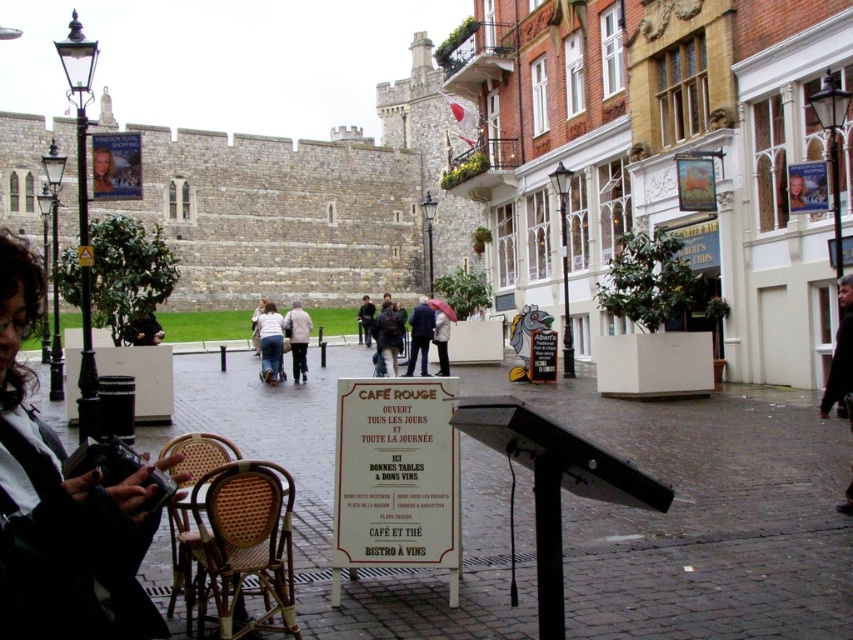
Is woven wicker chair at lower left above dark brown leather jacket at lower left?

Actually, woven wicker chair at lower left is below dark brown leather jacket at lower left.

Based on the photo, can you confirm if woven wicker chair at lower left is positioned to the left of dark brown leather jacket at lower left?

In fact, woven wicker chair at lower left is to the right of dark brown leather jacket at lower left.

Is point (183, 532) farther from viewer compared to point (131, 340)?

No, (183, 532) is in front of (131, 340).

Find the location of a particular element. woven wicker chair at lower left is located at coordinates (187, 566).

How far apart are dark gray jacket at lower left and dark blue jacket at center?

47.26 meters

Does dark gray jacket at lower left have a larger size compared to dark blue jacket at center?

No, dark gray jacket at lower left is not bigger than dark blue jacket at center.

What are the coordinates of `dark gray jacket at lower left` in the screenshot? It's located at (61, 506).

Can you confirm if dark blue jacket at center is positioned above matte black portrait at upper left?

Actually, dark blue jacket at center is below matte black portrait at upper left.

Is dark blue jacket at center to the left of matte black portrait at upper left from the viewer's perspective?

No, dark blue jacket at center is not to the left of matte black portrait at upper left.

Between point (386, 317) and point (109, 195), which one is positioned behind?

Point (386, 317)

Locate an element on the screen. dark blue jacket at center is located at coordinates (387, 337).